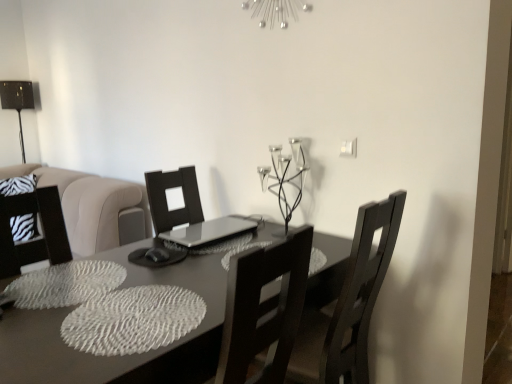
Question: From the image's perspective, is dark wood chair at center above or below metallic black candle holder at upper center?

Choices:
 (A) below
 (B) above

Answer: (A)

Question: Would you say dark wood chair at center is to the left or to the right of metallic black candle holder at upper center in the picture?

Choices:
 (A) right
 (B) left

Answer: (A)

Question: Estimate the real-world distances between objects in this image. Which object is closer to the silver metallic light fixture at upper center?

Choices:
 (A) metallic black table lamp at left
 (B) metallic black candle holder at upper center
 (C) dark wood chair at center
 (D) matte gray table at center

Answer: (B)

Question: Considering the real-world distances, which object is farthest from the metallic black table lamp at left?

Choices:
 (A) metallic black candle holder at upper center
 (B) silver metallic light fixture at upper center
 (C) dark wood chair at center
 (D) matte gray table at center

Answer: (C)